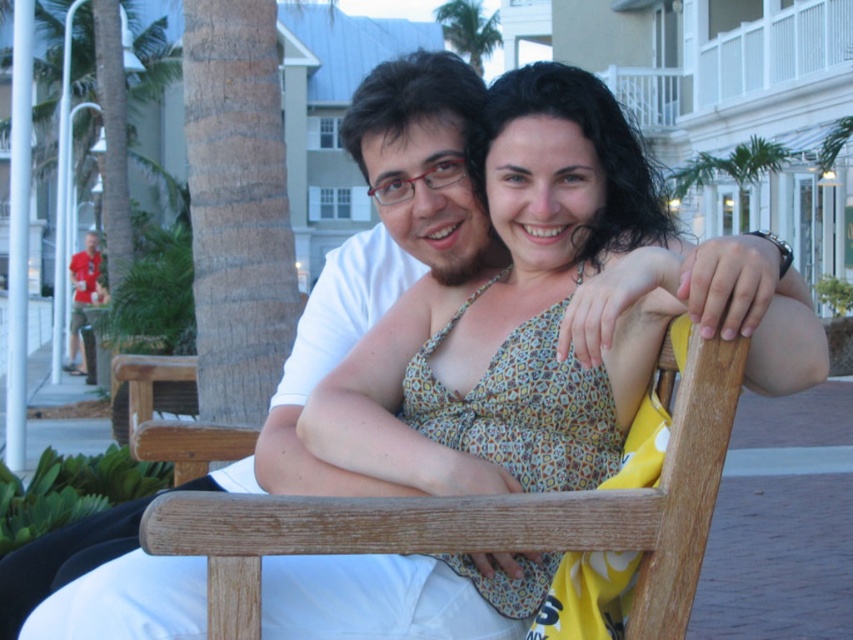
Can you confirm if green leafy palm tree at upper right is thinner than green leafy palm tree at upper center?

Indeed, green leafy palm tree at upper right has a lesser width compared to green leafy palm tree at upper center.

Does point (741, 204) lie in front of point (444, 4)?

Yes, it is.

At what (x,y) coordinates should I click in order to perform the action: click on green leafy palm tree at upper right. Please return your answer as a coordinate pair (x, y). Looking at the image, I should click on (730, 170).

Measure the distance between green leafy palm tree at upper right and matte red shirt at left.

green leafy palm tree at upper right and matte red shirt at left are 15.39 meters apart.

I want to click on green leafy palm tree at upper right, so click(730, 170).

This screenshot has height=640, width=853. What do you see at coordinates (730, 170) in the screenshot?
I see `green leafy palm tree at upper right` at bounding box center [730, 170].

You are a GUI agent. You are given a task and a screenshot of the screen. Output one action in this format:
    pyautogui.click(x=<x>, y=<y>)
    Task: Click on the green leafy palm tree at upper right
    Image resolution: width=853 pixels, height=640 pixels.
    Given the screenshot: What is the action you would take?
    pyautogui.click(x=730, y=170)

Does wooden chair at center appear on the right side of green leafy palm tree at upper center?

No, wooden chair at center is not to the right of green leafy palm tree at upper center.

Is wooden chair at center smaller than green leafy palm tree at upper center?

Correct, wooden chair at center occupies less space than green leafy palm tree at upper center.

In order to click on wooden chair at center in this screenshot , I will do (x=490, y=518).